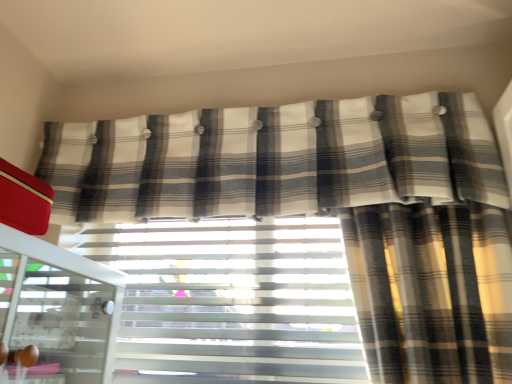
Question: Should I look upward or downward to see plaid fabric curtain at upper center?

Choices:
 (A) up
 (B) down

Answer: (A)

Question: Does plaid fabric curtain at upper center have a greater height compared to white textured blinds at center?

Choices:
 (A) yes
 (B) no

Answer: (B)

Question: Is plaid fabric curtain at upper center looking in the opposite direction of white textured blinds at center?

Choices:
 (A) yes
 (B) no

Answer: (B)

Question: Does plaid fabric curtain at upper center have a smaller size compared to white textured blinds at center?

Choices:
 (A) no
 (B) yes

Answer: (A)

Question: Is plaid fabric curtain at upper center at the left side of white textured blinds at center?

Choices:
 (A) yes
 (B) no

Answer: (B)

Question: Is plaid fabric curtain at upper center located outside white textured blinds at center?

Choices:
 (A) no
 (B) yes

Answer: (B)

Question: Is plaid fabric curtain at upper center next to white textured blinds at center?

Choices:
 (A) yes
 (B) no

Answer: (B)

Question: From the image's perspective, is plaid fabric curtain at upper center located beneath white glossy screen door at left?

Choices:
 (A) yes
 (B) no

Answer: (B)

Question: Considering the relative positions of plaid fabric curtain at upper center and white glossy screen door at left in the image provided, is plaid fabric curtain at upper center to the left of white glossy screen door at left from the viewer's perspective?

Choices:
 (A) yes
 (B) no

Answer: (B)

Question: Considering the relative sizes of plaid fabric curtain at upper center and white glossy screen door at left in the image provided, is plaid fabric curtain at upper center bigger than white glossy screen door at left?

Choices:
 (A) yes
 (B) no

Answer: (A)

Question: From a real-world perspective, is plaid fabric curtain at upper center on top of white glossy screen door at left?

Choices:
 (A) yes
 (B) no

Answer: (A)

Question: Are plaid fabric curtain at upper center and white glossy screen door at left making contact?

Choices:
 (A) yes
 (B) no

Answer: (B)

Question: Does plaid fabric curtain at upper center turn towards white glossy screen door at left?

Choices:
 (A) no
 (B) yes

Answer: (A)

Question: Is white textured blinds at center not near plaid fabric curtain at upper center?

Choices:
 (A) yes
 (B) no

Answer: (B)